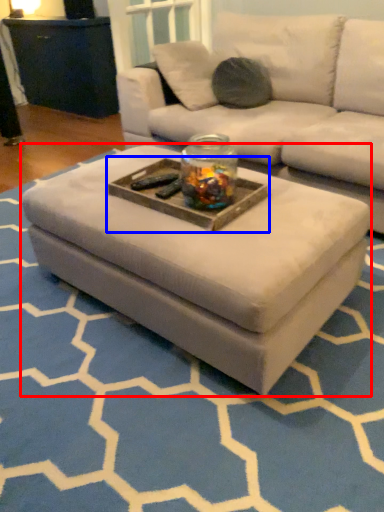
Question: Which of the following is the closest to the observer, coffee table (highlighted by a red box) or tray (highlighted by a blue box)?

Choices:
 (A) coffee table
 (B) tray

Answer: (A)